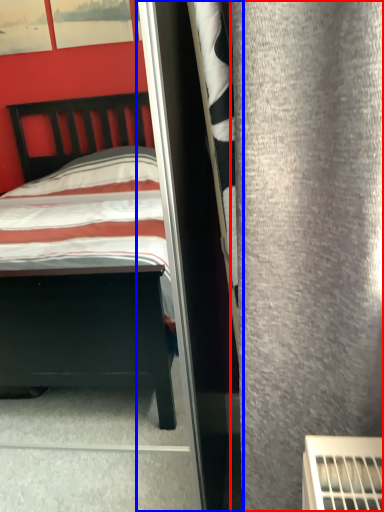
Question: Which object is further to the camera taking this photo, curtain (highlighted by a red box) or screen door (highlighted by a blue box)?

Choices:
 (A) curtain
 (B) screen door

Answer: (B)